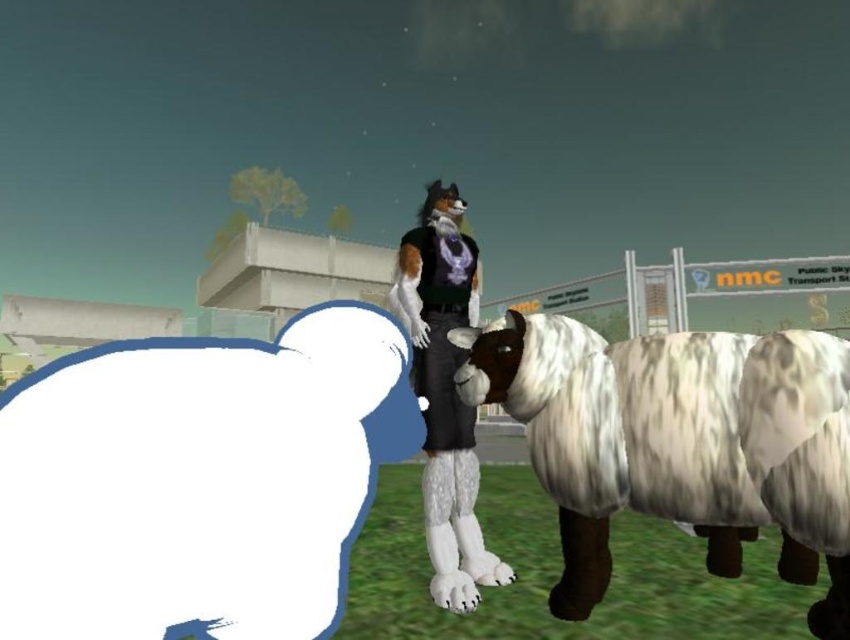
You are an observer in the scene. You see the white fur sheep at left and the fuzzy fur outfit at center. Which object is closer to you?

The white fur sheep at left is closer to you because it is in front of the fuzzy fur outfit at center.

You are an observer looking at the scene. There is a white woolen sheep at right and a fuzzy fur outfit at center. Which object is positioned lower in the image?

The white woolen sheep at right is positioned lower than the fuzzy fur outfit at center.

You are an animal caretaker in a farm. You see two sheep, the white fur sheep at left and the white woolen sheep at right. Which one is positioned more to the left side of the image?

The white fur sheep at left is positioned more to the left side of the image compared to the white woolen sheep at right.